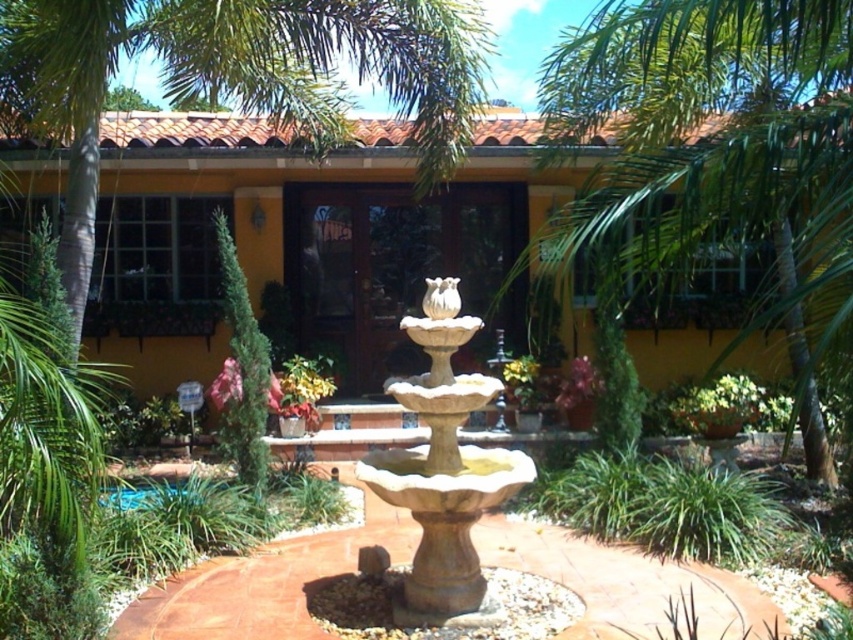
Is green leafy palm tree at upper right positioned before beige stone fountain at center?

Yes, green leafy palm tree at upper right is closer to the viewer.

Can you confirm if green leafy palm tree at upper right is bigger than beige stone fountain at center?

Correct, green leafy palm tree at upper right is larger in size than beige stone fountain at center.

Which is behind, point (799, 86) or point (490, 392)?

Point (799, 86)

Find the location of a particular element. green leafy palm tree at upper right is located at coordinates pos(718,148).